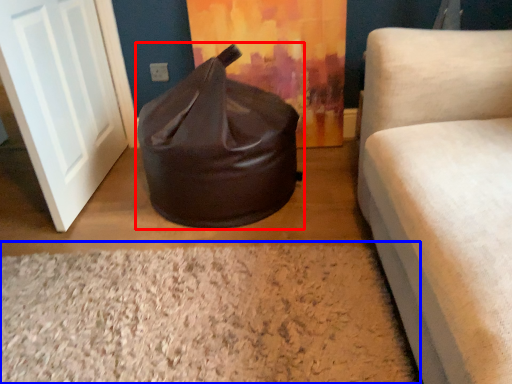
Question: Which of the following is the farthest to the observer, bean bag chair (highlighted by a red box) or granite (highlighted by a blue box)?

Choices:
 (A) bean bag chair
 (B) granite

Answer: (A)